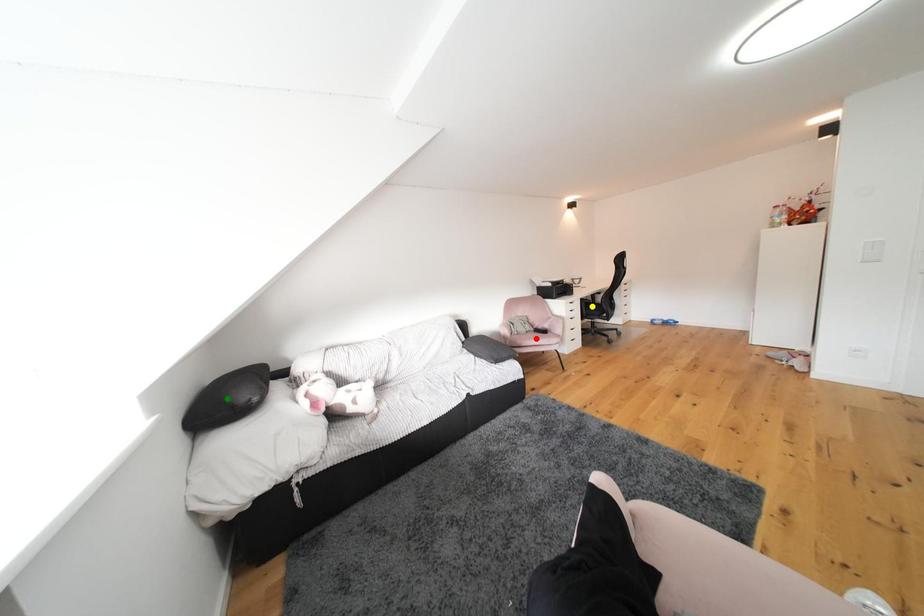
Order these from nearest to farthest:
yellow point
red point
green point

green point
red point
yellow point